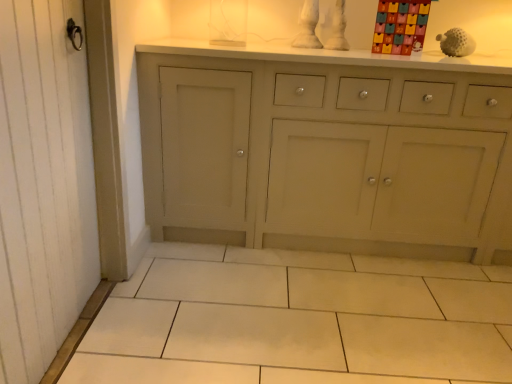
Question: From the image's perspective, is multicolored cardboard advent calendar at upper right, marked as the second toy in a right-to-left arrangement, above or below white matte golf ball at upper right, acting as the 2th toy starting from the left?

Choices:
 (A) below
 (B) above

Answer: (B)

Question: From a real-world perspective, relative to white matte golf ball at upper right, which is the 1th toy in right-to-left order, is multicolored cardboard advent calendar at upper right, the 1th toy viewed from the left, vertically above or below?

Choices:
 (A) below
 (B) above

Answer: (B)

Question: Estimate the real-world distances between objects in this image. Which object is farther from the white matte golf ball at upper right, which is the 1th toy in right-to-left order?

Choices:
 (A) multicolored cardboard advent calendar at upper right, the 1th toy viewed from the left
 (B) white wood screen door at left

Answer: (B)

Question: Considering the real-world distances, which object is farthest from the multicolored cardboard advent calendar at upper right, the 1th toy viewed from the left?

Choices:
 (A) white matte golf ball at upper right, acting as the 2th toy starting from the left
 (B) white wood screen door at left

Answer: (B)